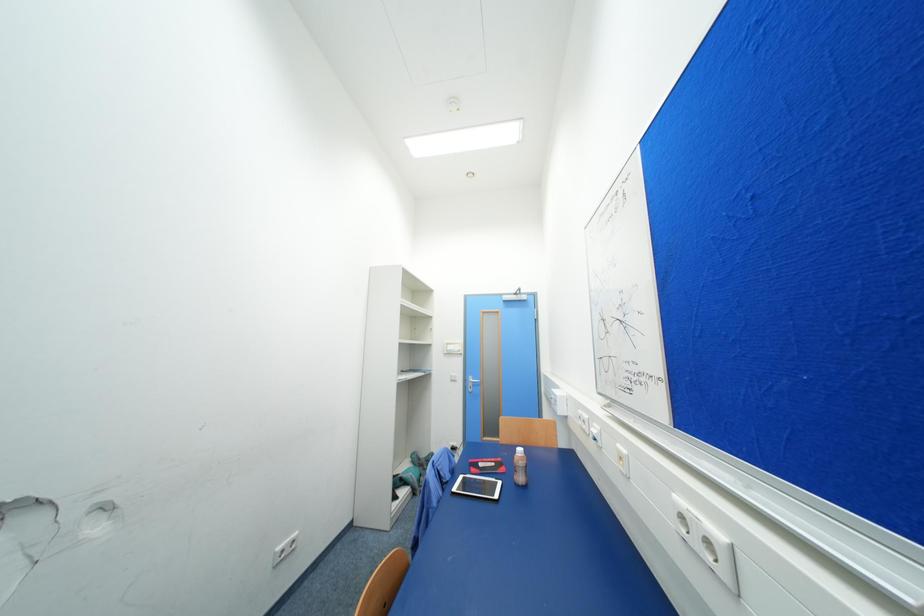
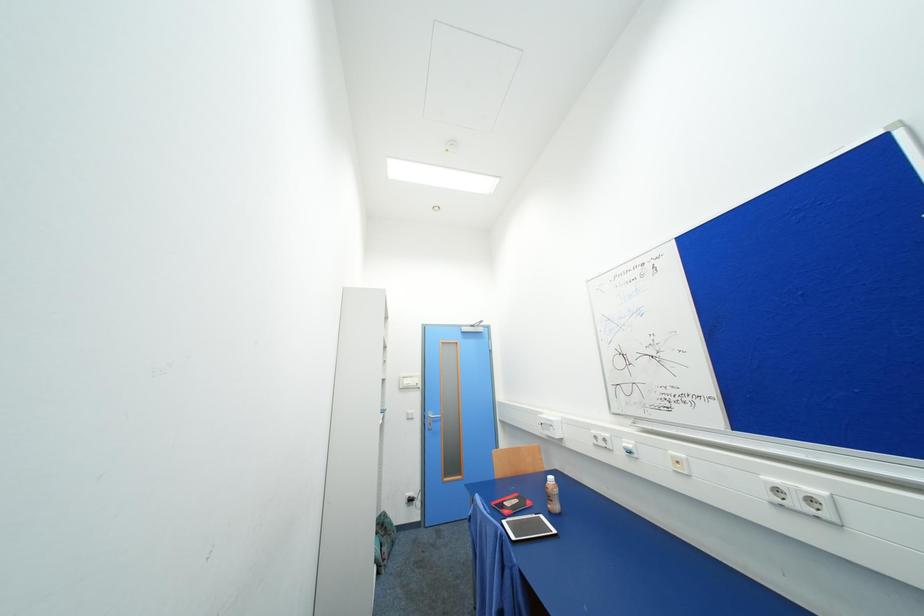
Question: The images are taken continuously from a first-person perspective. In which direction is your viewpoint rotating?

Choices:
 (A) Left
 (B) Right
 (C) Up
 (D) Down

Answer: (B)